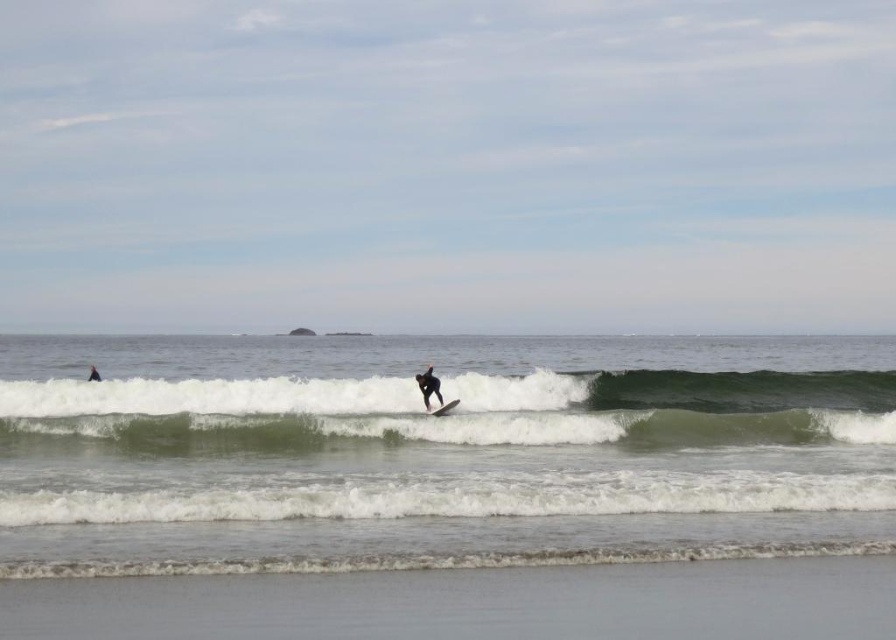
Which is more to the right, black matte surfboard at center or white foam surfboard at center?

white foam surfboard at center

Who is positioned more to the left, black matte surfboard at center or white foam surfboard at center?

Positioned to the left is black matte surfboard at center.

Find the location of a particular element. Image resolution: width=896 pixels, height=640 pixels. black matte surfboard at center is located at coordinates (428, 385).

You are a GUI agent. You are given a task and a screenshot of the screen. Output one action in this format:
    pyautogui.click(x=<x>, y=<y>)
    Task: Click on the black matte surfboard at center
    The width and height of the screenshot is (896, 640).
    Given the screenshot: What is the action you would take?
    pyautogui.click(x=428, y=385)

Is point (406, 532) behind point (431, 372)?

No, it is not.

How distant is clear water at center from black matte surfboard at center?

clear water at center is 41.77 meters from black matte surfboard at center.

Is point (247, 380) positioned before point (418, 380)?

No, it is behind (418, 380).

Identify the location of clear water at center. This screenshot has height=640, width=896. (438, 451).

Does clear water at center have a lesser width compared to white foam surfboard at center?

In fact, clear water at center might be wider than white foam surfboard at center.

Is clear water at center positioned before white foam surfboard at center?

Yes, clear water at center is in front of white foam surfboard at center.

Which is in front, point (248, 564) or point (444, 406)?

Point (248, 564) is more forward.

Find the location of `clear water at center`. clear water at center is located at coordinates (438, 451).